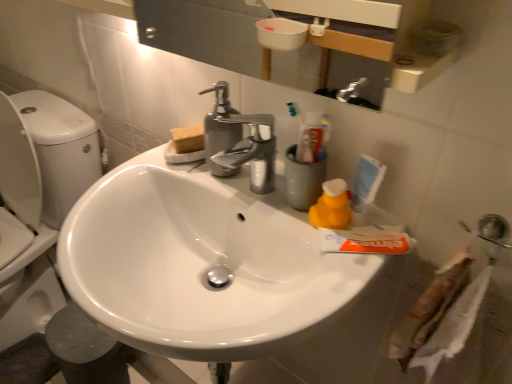
The height and width of the screenshot is (384, 512). I want to click on free space in front of yellow rubber duck at right, so click(325, 281).